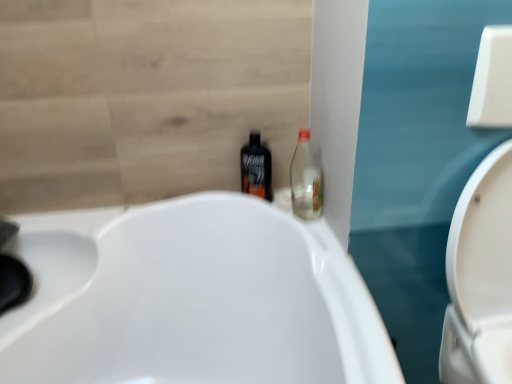
Question: Is transparent glass bottle at center-right, the 1th bottle from the right, taller or shorter than black plastic bottle at center, the second bottle from the right?

Choices:
 (A) tall
 (B) short

Answer: (B)

Question: Is point (297, 195) positioned closer to the camera than point (251, 162)?

Choices:
 (A) farther
 (B) closer

Answer: (A)

Question: Which of these objects is positioned farthest from the transparent glass bottle at center-right, the 1th bottle from the right?

Choices:
 (A) black plastic bottle at center, the 1th bottle positioned from the left
 (B) white glossy toilet at right

Answer: (B)

Question: Which object is the farthest from the white glossy toilet at right?

Choices:
 (A) black plastic bottle at center, the second bottle from the right
 (B) transparent glass bottle at center-right, the 1th bottle from the right

Answer: (A)